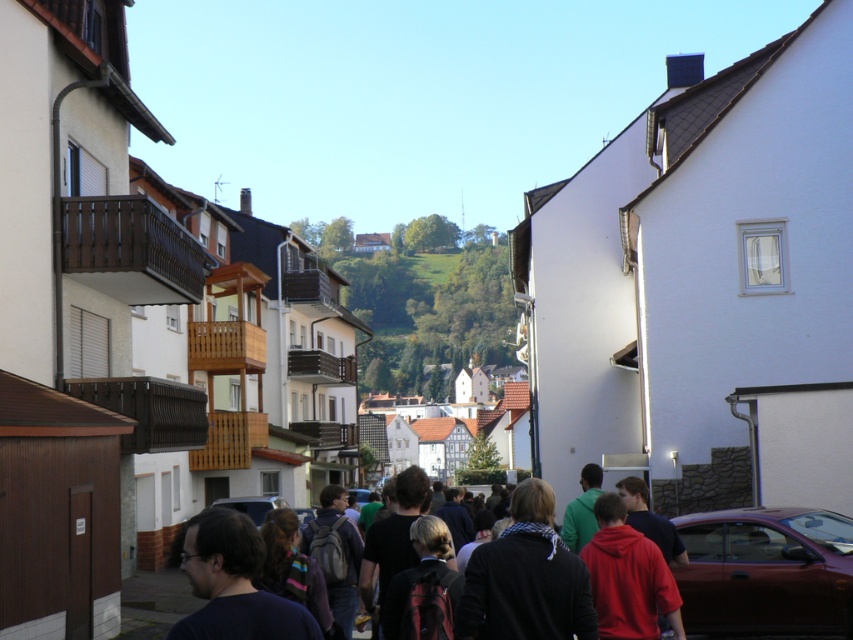
You are a photographer standing at the corner of the street. You want to take a photo of the shiny metallic car at lower right and the dark clothing group at center. Which object is narrower in the image?

The shiny metallic car at lower right is thinner than the dark clothing group at center, so the shiny metallic car at lower right is narrower in the image.

You are a photographer standing at the camera position. You want to take a picture of the shiny metallic car at lower right. The camera has a maximum focus range of 30 meters. Will the car be in focus?

The shiny metallic car at lower right is 31.47 meters from the camera. Since the camera can only focus up to 30 meters, the car will not be in focus.

You are a pedestrian standing at the dark clothing group at center. You want to cross the street to reach a store located behind the shiny metallic car at lower right. The road is 10 meters wide. Can you safely cross the road before the car moves forward? Assume the car is stationary now but may start moving any moment.

The distance between the shiny metallic car at lower right and the dark clothing group at center is 5.16 meters. Since the road is 10 meters wide, the pedestrian would need to cross the remaining 4.84 meters to reach the store. However, without knowing the car movement timing or traffic signals, it is unsafe to assume safe crossing. Wait for a safe opportunity.